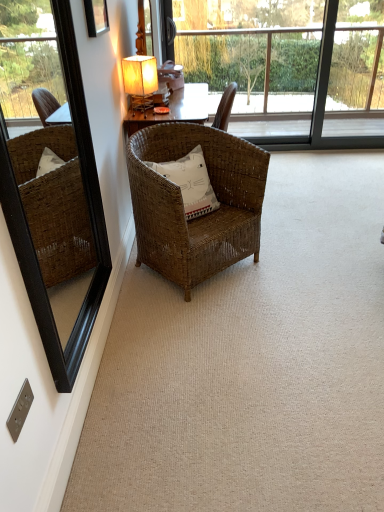
This screenshot has height=512, width=384. Find the location of `free point below black wood mirror at left (from a real-world perspective)`. free point below black wood mirror at left (from a real-world perspective) is located at coordinates (108, 365).